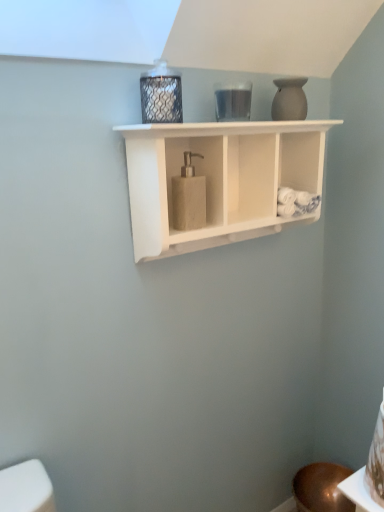
Question: Is white matte soap dispenser at center in front of matte white vase at upper right?

Choices:
 (A) yes
 (B) no

Answer: (A)

Question: Can you confirm if white matte soap dispenser at center is thinner than matte white vase at upper right?

Choices:
 (A) yes
 (B) no

Answer: (B)

Question: From the image's perspective, would you say white matte soap dispenser at center is shown under matte white vase at upper right?

Choices:
 (A) no
 (B) yes

Answer: (B)

Question: Considering the relative sizes of white matte soap dispenser at center and matte white vase at upper right in the image provided, is white matte soap dispenser at center smaller than matte white vase at upper right?

Choices:
 (A) no
 (B) yes

Answer: (A)

Question: Can you confirm if white matte soap dispenser at center is bigger than matte white vase at upper right?

Choices:
 (A) no
 (B) yes

Answer: (B)

Question: Would you say white matte soap dispenser at center is to the left or to the right of matte white vase at upper right in the picture?

Choices:
 (A) right
 (B) left

Answer: (B)

Question: Is point (208, 136) positioned closer to the camera than point (281, 119)?

Choices:
 (A) closer
 (B) farther

Answer: (A)

Question: Relative to matte white vase at upper right, is white matte soap dispenser at center in front or behind?

Choices:
 (A) behind
 (B) front

Answer: (B)

Question: From their relative heights in the image, would you say white matte soap dispenser at center is taller or shorter than matte white vase at upper right?

Choices:
 (A) short
 (B) tall

Answer: (B)

Question: From their relative heights in the image, would you say matte white vase at upper right is taller or shorter than beige textured soap dispenser at center?

Choices:
 (A) tall
 (B) short

Answer: (B)

Question: Looking at their shapes, would you say matte white vase at upper right is wider or thinner than beige textured soap dispenser at center?

Choices:
 (A) wide
 (B) thin

Answer: (A)

Question: From a real-world perspective, is matte white vase at upper right physically located above or below beige textured soap dispenser at center?

Choices:
 (A) above
 (B) below

Answer: (A)

Question: From the image's perspective, is matte white vase at upper right located above or below beige textured soap dispenser at center?

Choices:
 (A) below
 (B) above

Answer: (B)

Question: In the image, is white matte soap dispenser at center positioned in front of or behind beige textured soap dispenser at center?

Choices:
 (A) behind
 (B) front

Answer: (B)

Question: Does point (145, 239) appear closer or farther from the camera than point (193, 187)?

Choices:
 (A) farther
 (B) closer

Answer: (A)